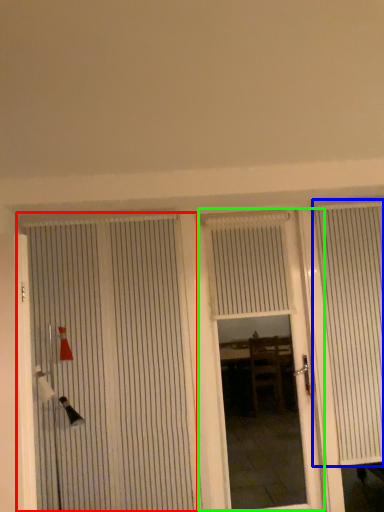
Question: Which object is the closest to the door (highlighted by a red box)? Choose among these: curtain (highlighted by a blue box) or door (highlighted by a green box).

Choices:
 (A) curtain
 (B) door

Answer: (A)